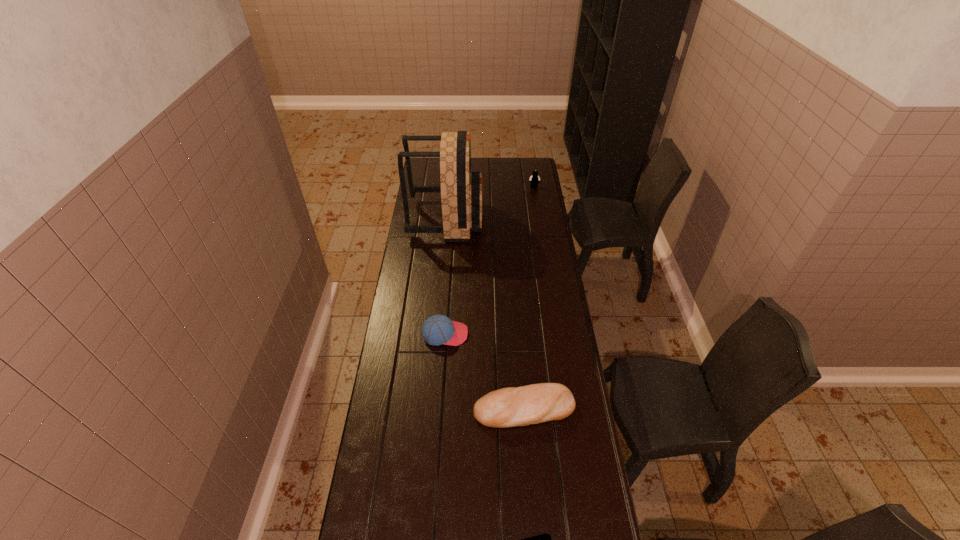
Locate an element on the screen. The width and height of the screenshot is (960, 540). backpack that is at the left edge is located at coordinates (461, 191).

Identify the location of baseball cap that is at the left edge. The width and height of the screenshot is (960, 540). (438, 329).

Find the location of a particular element. Lego that is at the right edge is located at coordinates (534, 179).

Locate an element on the screen. bread at the right edge is located at coordinates tap(513, 406).

In the image, there is a desktop. Where is `vacant area at the left edge`? This screenshot has width=960, height=540. vacant area at the left edge is located at coordinates (432, 186).

Find the location of a particular element. This screenshot has width=960, height=540. free region at the right edge of the desktop is located at coordinates (536, 206).

In order to click on vacant space at the far right corner in this screenshot , I will do point(522,176).

Where is `unoccupied position between the Lego and the second nearest object`? unoccupied position between the Lego and the second nearest object is located at coordinates (529, 298).

Identify the location of vacant area between the tallest object and the fourth shortest object. click(491, 203).

Image resolution: width=960 pixels, height=540 pixels. In order to click on unoccupied area between the tallest object and the third nearest object in this screenshot , I will do `click(445, 276)`.